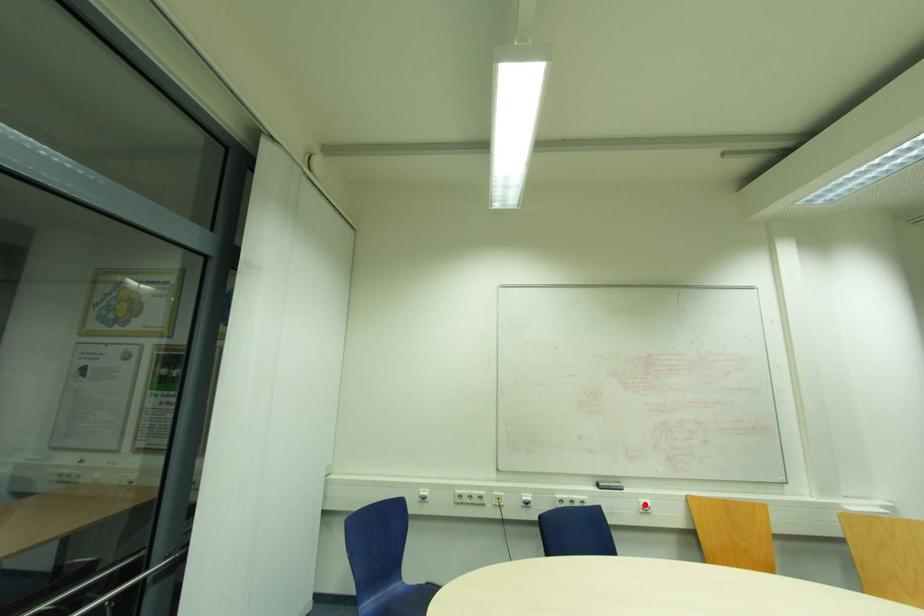
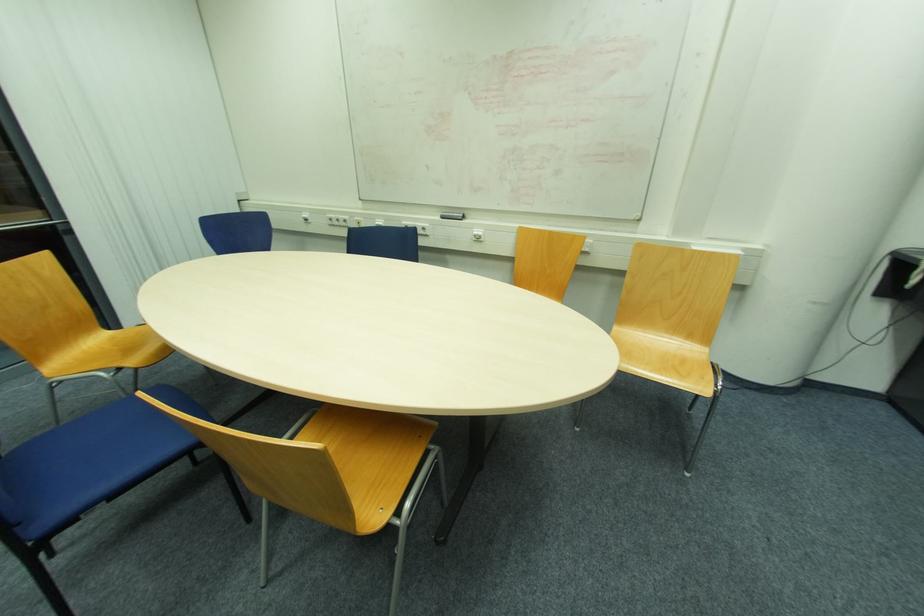
Question: I am providing you with two images of the same scene from different viewpoints. Given a red point in image1, look at the same physical point in image2. Is it:

Choices:
 (A) Closer to the viewpoint
 (B) Farther from the viewpoint

Answer: (A)